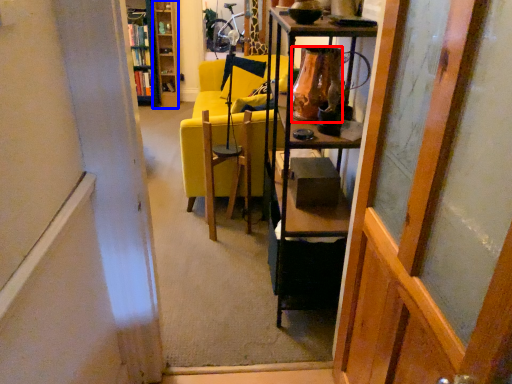
Question: Among these objects, which one is farthest to the camera, vase (highlighted by a red box) or cabinetry (highlighted by a blue box)?

Choices:
 (A) vase
 (B) cabinetry

Answer: (B)